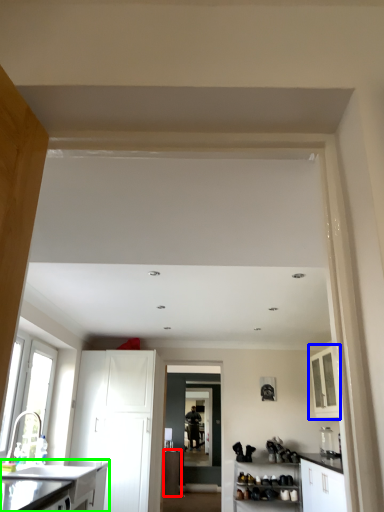
Question: Based on their relative distances, which object is nearer to cabinetry (highlighted by a red box)? Choose from cabinetry (highlighted by a blue box) and cabinetry (highlighted by a green box).

Choices:
 (A) cabinetry
 (B) cabinetry

Answer: (A)